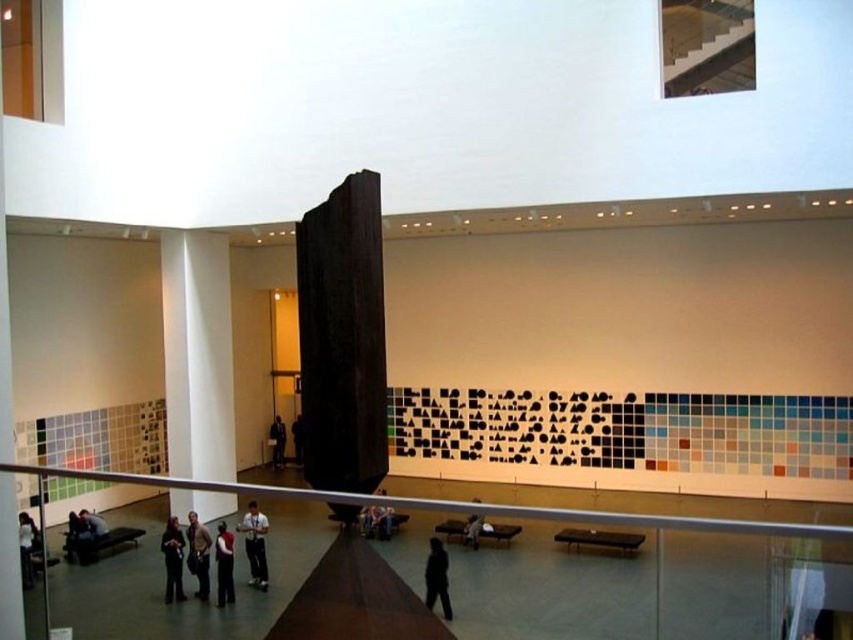
You are standing at the point labeled point [277,436] in the museum. The exit door is located at the other point. If you walk straight towards the exit, will you pass by the large dark monolithic sculpture in the center?

Yes, you will pass by the large dark monolithic sculpture in the center because the distance between you and the exit is 24.99 meters, implying the sculpture is along the straight path between them.

You are an art curator planning to install a new light fixture above the dark brown leather jacket at center and the dark brown wooden statue at center. The fixture has a minimum height requirement of 2 meters from the floor to ensure proper illumination. Given the height of these objects, can you determine if the light fixture will be positioned correctly?

The dark brown leather jacket at center has a greater height compared to dark brown wooden statue at center. Since the light fixture requires a minimum height of 2 meters, the jacket must be at least 2 meters tall. Therefore, the light fixture can be installed as specified.